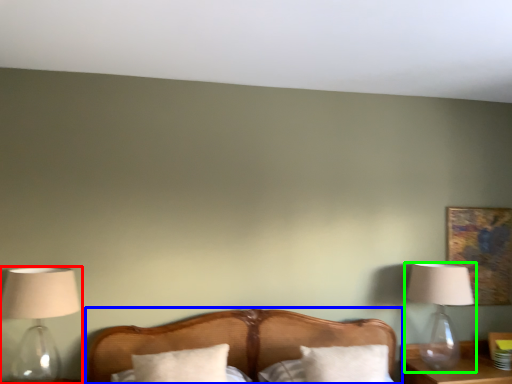
Question: Based on their relative distances, which object is nearer to lamp (highlighted by a red box)? Choose from bed (highlighted by a blue box) and lamp (highlighted by a green box).

Choices:
 (A) bed
 (B) lamp

Answer: (A)